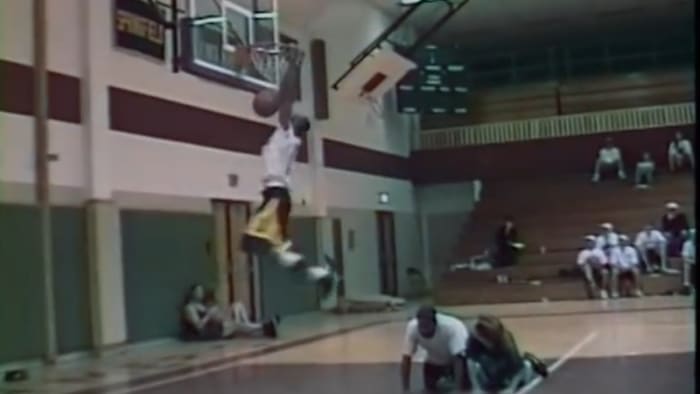
Identify the location of 1 seating area. Image resolution: width=700 pixels, height=394 pixels. (582, 222).